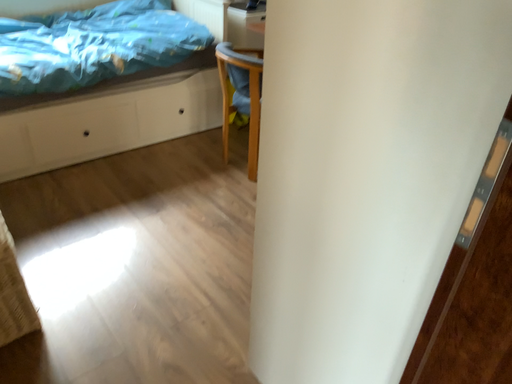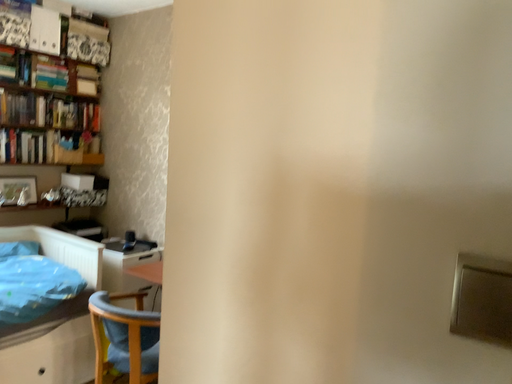
Question: How did the camera likely rotate when shooting the video?

Choices:
 (A) rotated upward
 (B) rotated downward

Answer: (A)